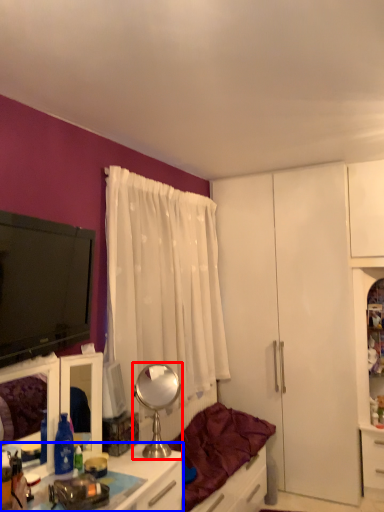
Question: Which of the following is the farthest to the observer, mirror (highlighted by a red box) or desk (highlighted by a blue box)?

Choices:
 (A) mirror
 (B) desk

Answer: (A)